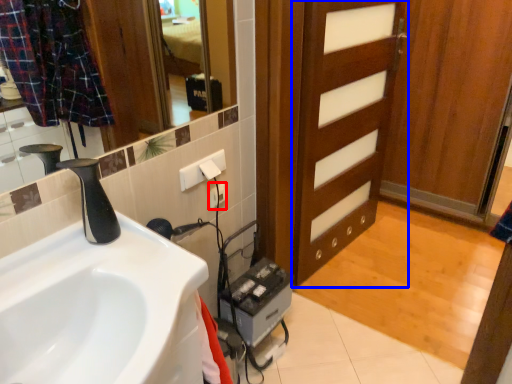
Question: Which point is further to the camera, electric outlet (highlighted by a red box) or door (highlighted by a blue box)?

Choices:
 (A) electric outlet
 (B) door

Answer: (A)